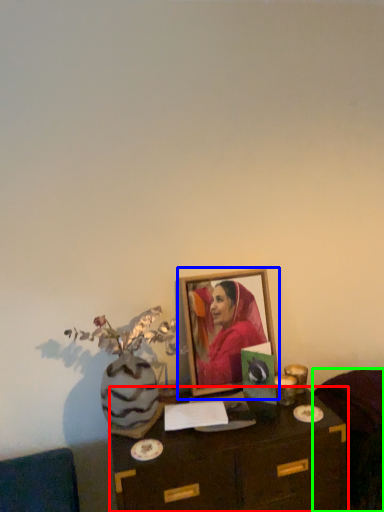
Question: Estimate the real-world distances between objects in this image. Which object is closer to table (highlighted by a red box), picture frame (highlighted by a blue box) or furniture (highlighted by a green box)?

Choices:
 (A) picture frame
 (B) furniture

Answer: (B)